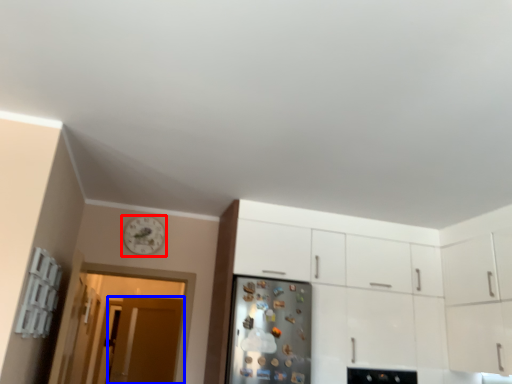
Question: Which object is closer to the camera taking this photo, clock (highlighted by a red box) or door (highlighted by a blue box)?

Choices:
 (A) clock
 (B) door

Answer: (A)